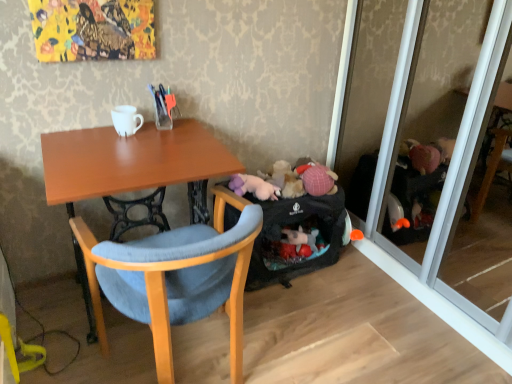
Find the location of a particular element. The width and height of the screenshot is (512, 384). free point in front of white glossy coffee cup at upper center is located at coordinates (115, 148).